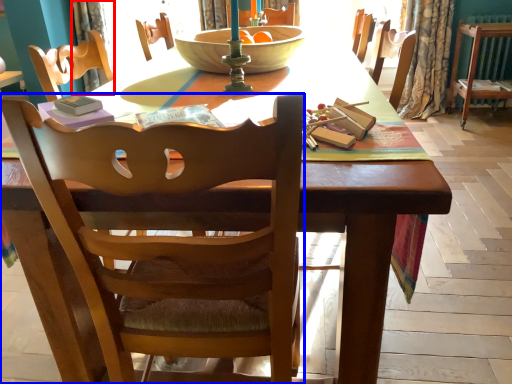
Question: Which point is closer to the camera, curtain (highlighted by a red box) or chair (highlighted by a blue box)?

Choices:
 (A) curtain
 (B) chair

Answer: (B)